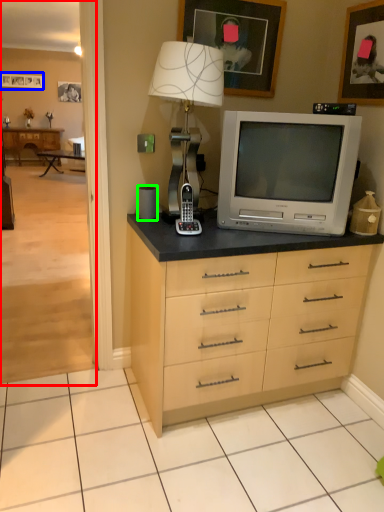
Question: Which object is positioned closest to corridor (highlighted by a red box)? Select from picture frame (highlighted by a blue box) and speaker (highlighted by a green box).

Choices:
 (A) picture frame
 (B) speaker

Answer: (A)